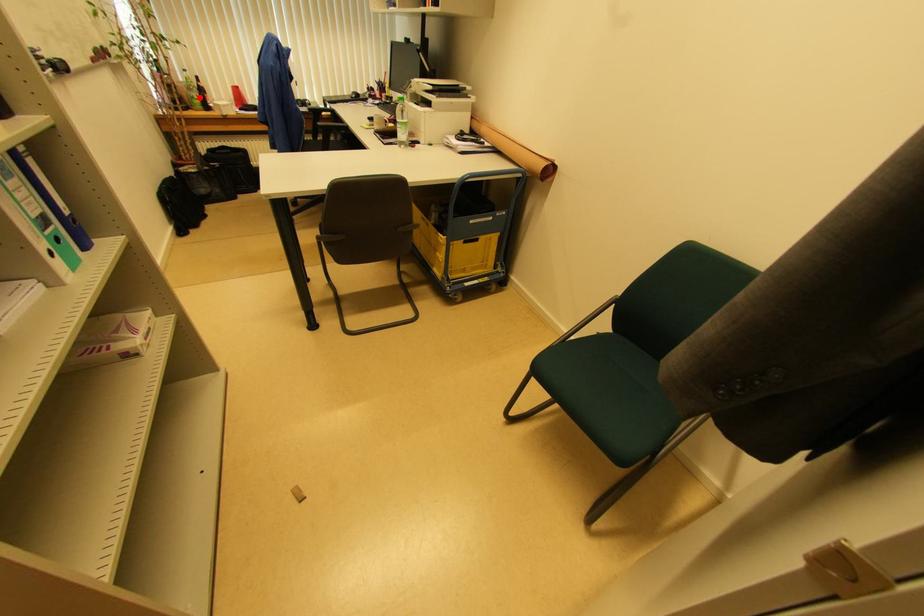
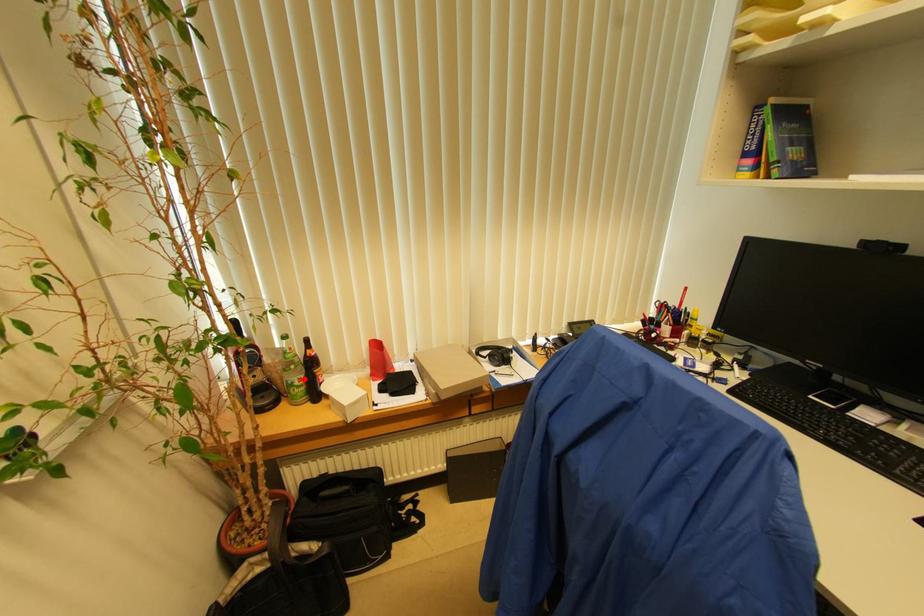
I am providing you with two images of the same scene from different viewpoints. A red point is marked on the first image and another point is marked on the second image. Are the points marked in image1 and image2 representing the same 3D position?

Yes